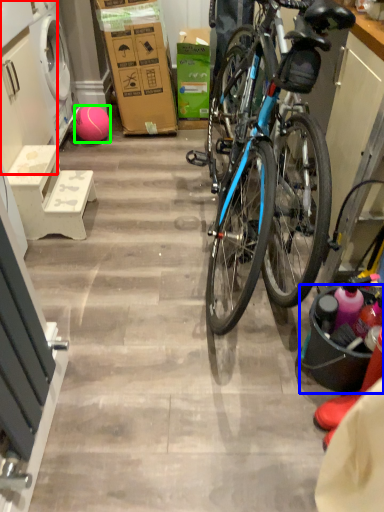
Question: Considering the real-world distances, which object is farthest from cabinetry (highlighted by a red box)? bucket (highlighted by a blue box) or ball (highlighted by a green box)?

Choices:
 (A) bucket
 (B) ball

Answer: (A)